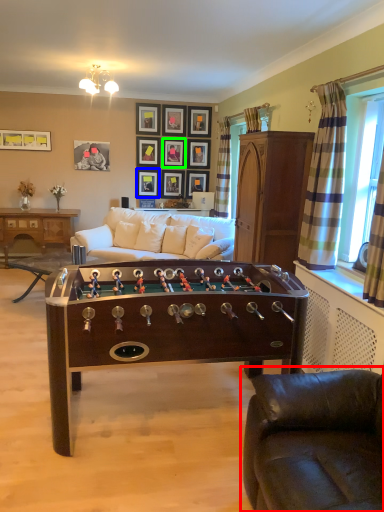
Question: Which object is positioned farthest from studio couch (highlighted by a red box)? Select from picture frame (highlighted by a blue box) and picture frame (highlighted by a green box).

Choices:
 (A) picture frame
 (B) picture frame

Answer: (B)